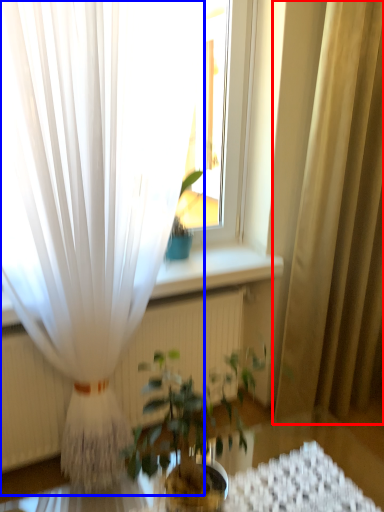
Question: Which object appears farthest to the camera in this image, curtain (highlighted by a red box) or curtain (highlighted by a blue box)?

Choices:
 (A) curtain
 (B) curtain

Answer: (A)